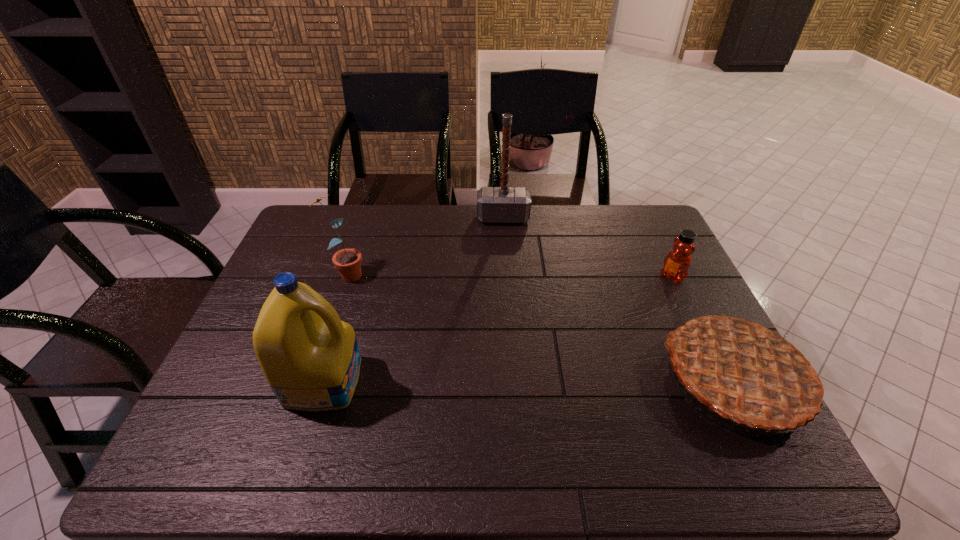
The height and width of the screenshot is (540, 960). I want to click on vacant space that satisfies the following two spatial constraints: 1. on the front side of the pie; 2. on the left side of the hammer, so click(515, 379).